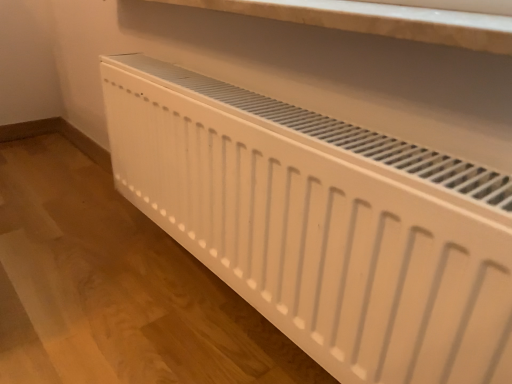
Question: Is white matte radiator at lower center inside the boundaries of white marble shelf at upper center, or outside?

Choices:
 (A) inside
 (B) outside

Answer: (B)

Question: Is white matte radiator at lower center in front of or behind white marble shelf at upper center in the image?

Choices:
 (A) behind
 (B) front

Answer: (B)

Question: From the image's perspective, is white matte radiator at lower center positioned above or below white marble shelf at upper center?

Choices:
 (A) above
 (B) below

Answer: (B)

Question: From a real-world perspective, is white marble shelf at upper center physically located above or below white matte radiator at lower center?

Choices:
 (A) below
 (B) above

Answer: (B)

Question: Is white marble shelf at upper center taller or shorter than white matte radiator at lower center?

Choices:
 (A) tall
 (B) short

Answer: (B)

Question: Is white marble shelf at upper center in front of or behind white matte radiator at lower center in the image?

Choices:
 (A) front
 (B) behind

Answer: (B)

Question: Is point (315, 16) closer or farther from the camera than point (472, 218)?

Choices:
 (A) closer
 (B) farther

Answer: (B)